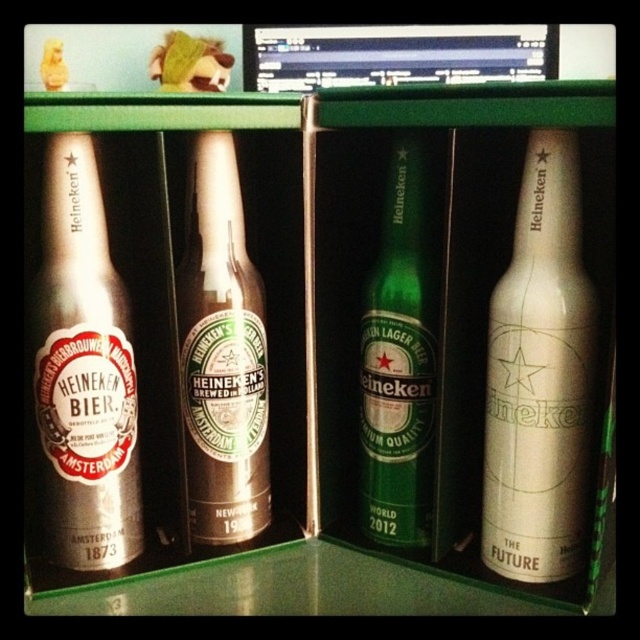
You are looking at the collection of Heineken bottles in the green box. Where exactly is the green glass bottle at center located in terms of coordinates?

The green glass bottle at center is located at point coordinates of (401,353).

Which bottle is located at the coordinates point (221, 355)?

The point (221, 355) is on the brown glass bottle at center.

You are setting up a display for a tech event and have both the brown glass bottle at center and the black glossy monitor at upper center. Which object should you place higher to ensure the taller item is visible?

The brown glass bottle at center is taller than the black glossy monitor at upper center, so you should place the brown glass bottle at center higher to ensure it is visible.